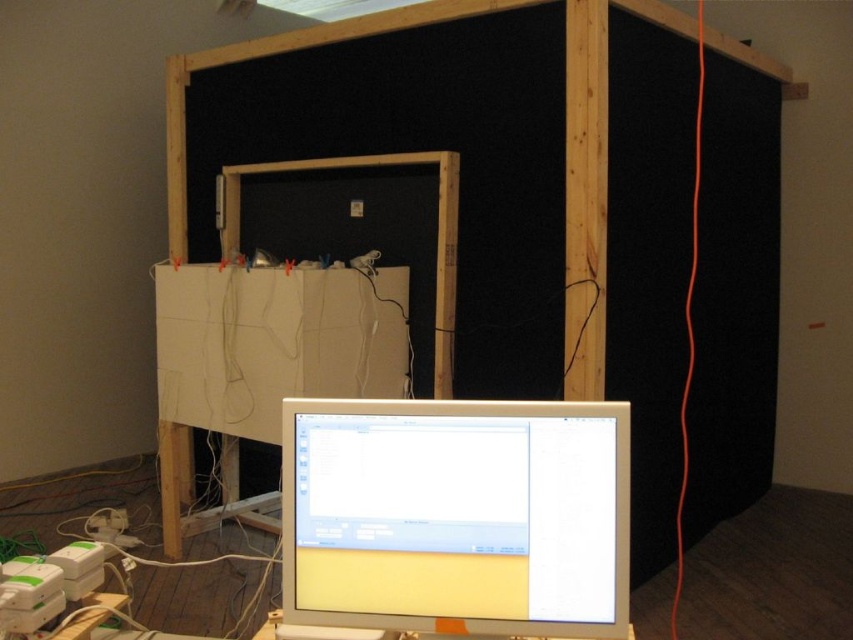
Question: Which point is closer to the camera?

Choices:
 (A) white cardboard at center
 (B) white glossy monitor at center

Answer: (B)

Question: Which point is closer to the camera taking this photo?

Choices:
 (A) (381, 552)
 (B) (189, 428)

Answer: (A)

Question: Is white glossy monitor at center bigger than white cardboard at center?

Choices:
 (A) no
 (B) yes

Answer: (A)

Question: Can you confirm if white glossy monitor at center is bigger than white cardboard at center?

Choices:
 (A) no
 (B) yes

Answer: (A)

Question: Is white glossy monitor at center bigger than white cardboard at center?

Choices:
 (A) yes
 (B) no

Answer: (B)